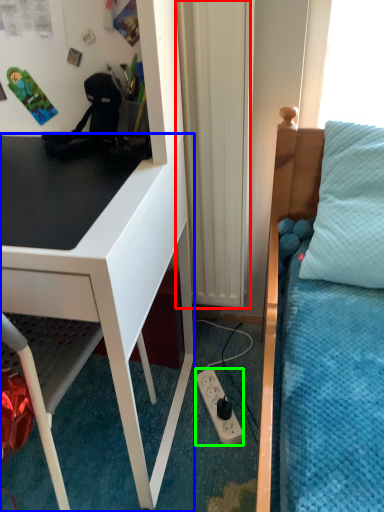
Question: Which object is the closest to the curtain (highlighted by a red box)? Choose among these: desk (highlighted by a blue box) or power outlet (highlighted by a green box).

Choices:
 (A) desk
 (B) power outlet

Answer: (A)